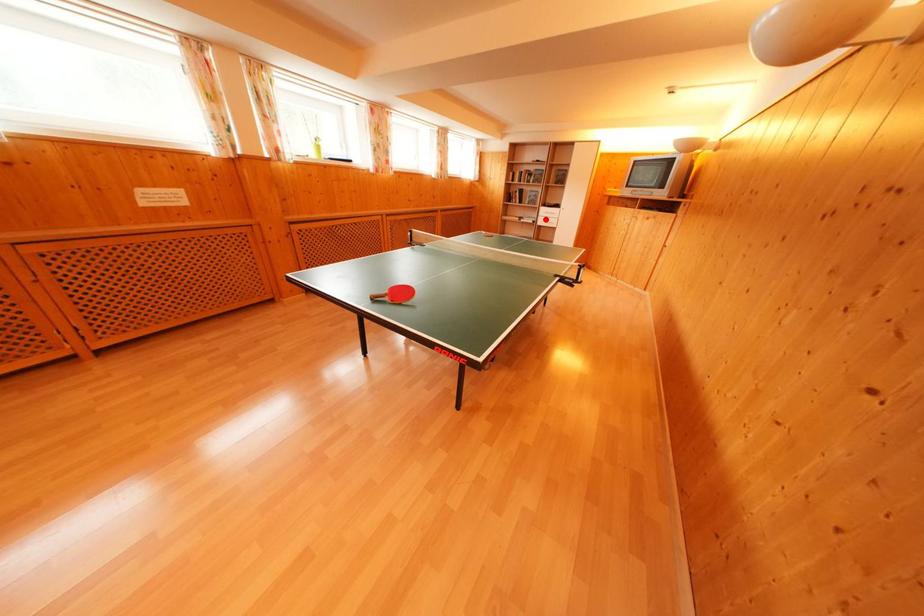
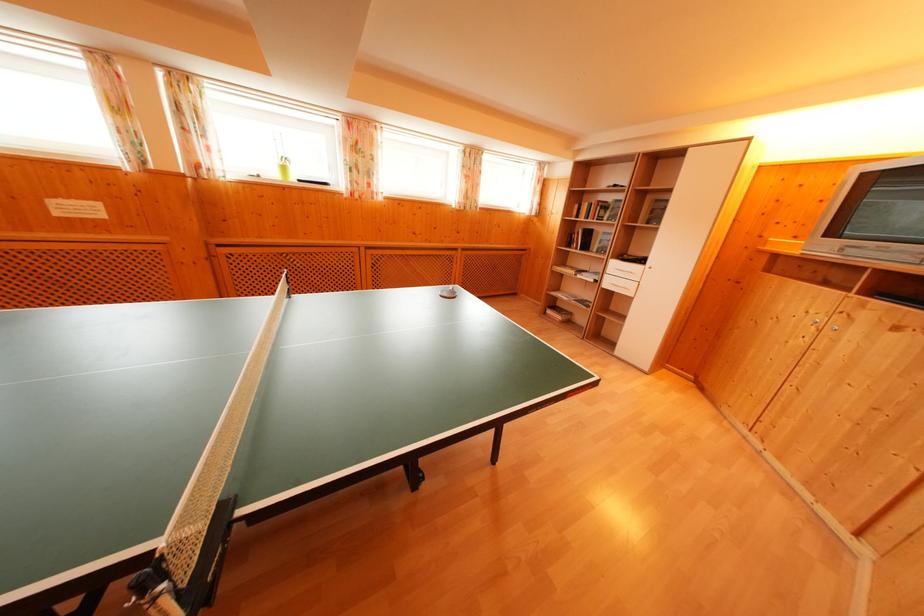
The point at the highlighted location is marked in the first image. Where is the corresponding point in the second image?

(614, 276)